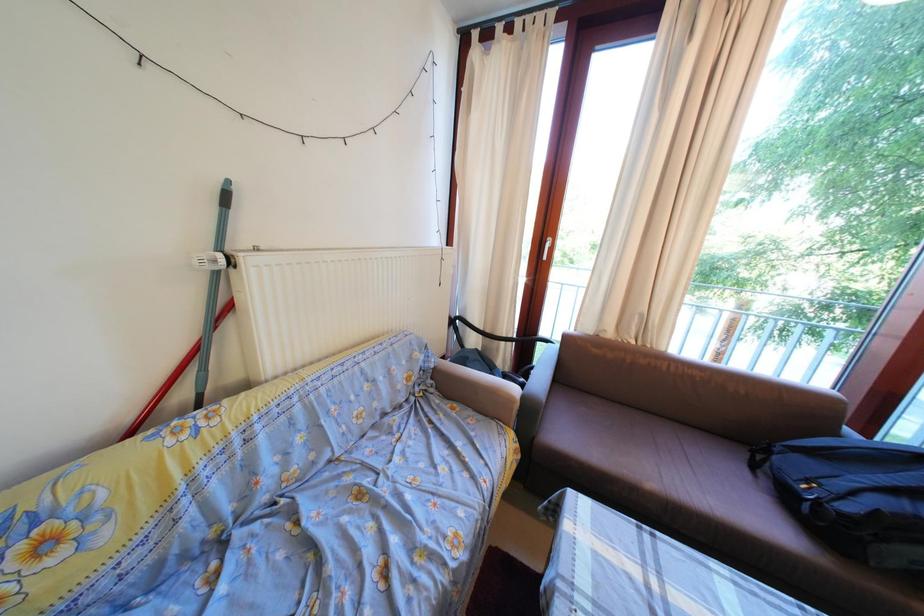
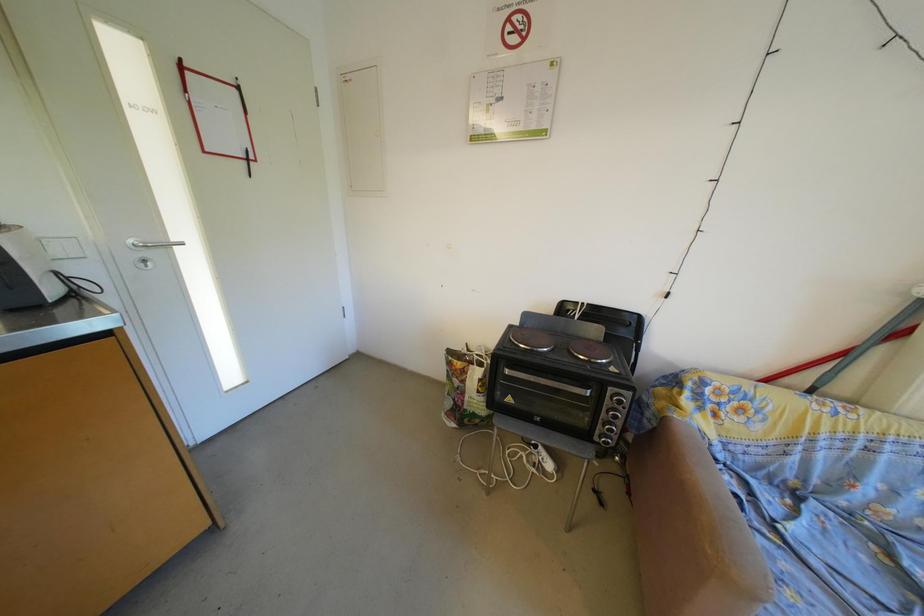
Question: The images are taken continuously from a first-person perspective. In which direction is your viewpoint rotating?

Choices:
 (A) Left
 (B) Right
 (C) Up
 (D) Down

Answer: (A)